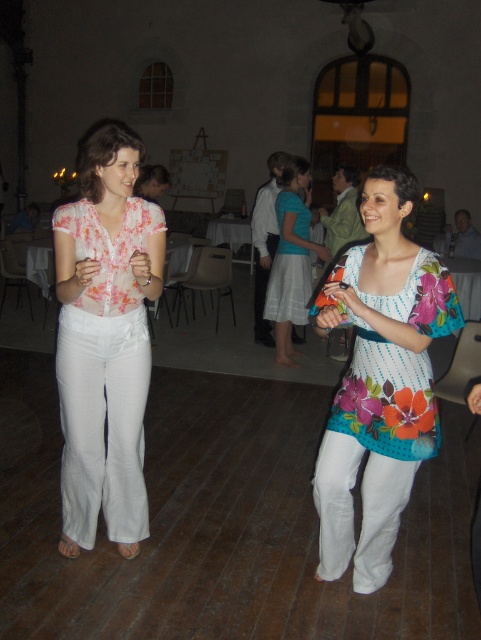
You are planning to place a 10 feet long decorative banner between the floral fabric blouse at center and the light blue fabric skirt at center. Will the banner fit without overlapping either of them?

The distance between the floral fabric blouse at center and the light blue fabric skirt at center is 9.33 feet. Since the banner is 10 feet long, it will be 0.67 feet longer than the space available, so it will overlap both objects.

In the image, there are two women wearing blouses at the center. The first woman wears a floral fabric blouse at center, and the second wears a floral printed blouse at center. Which blouse has a narrower width?

The floral fabric blouse at center has a lesser width compared to the floral printed blouse at center, so the floral fabric blouse at center is narrower.